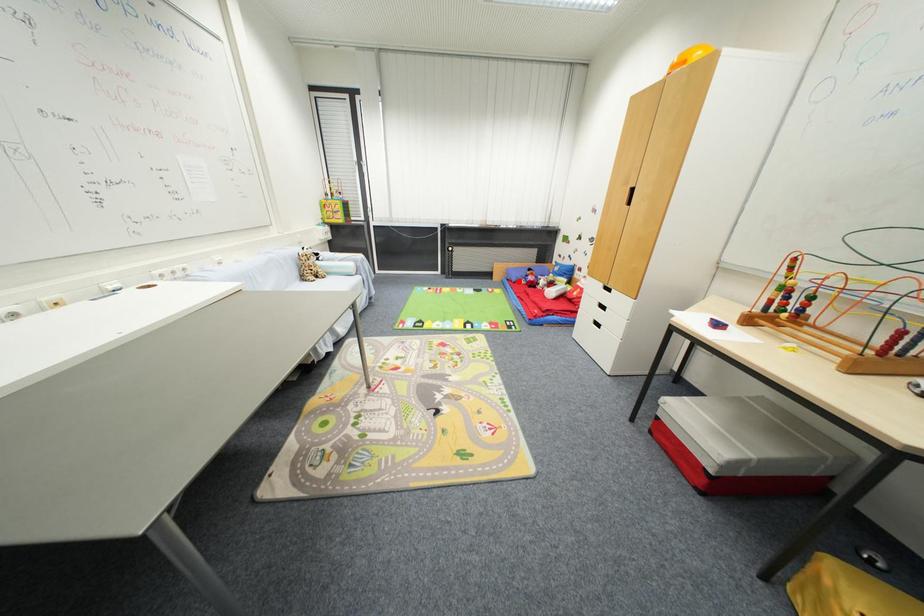
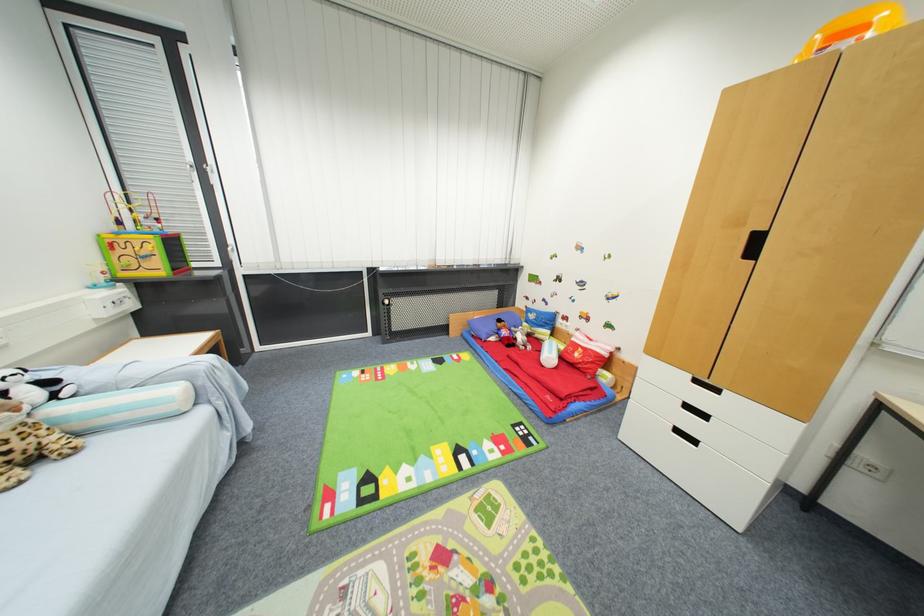
Question: A red point is marked in image1. In image2, is the corresponding 3D point closer to the camera or farther? Reply with the corresponding letter.

Choices:
 (A) The corresponding 3D point is closer.
 (B) The corresponding 3D point is farther.

Answer: (B)